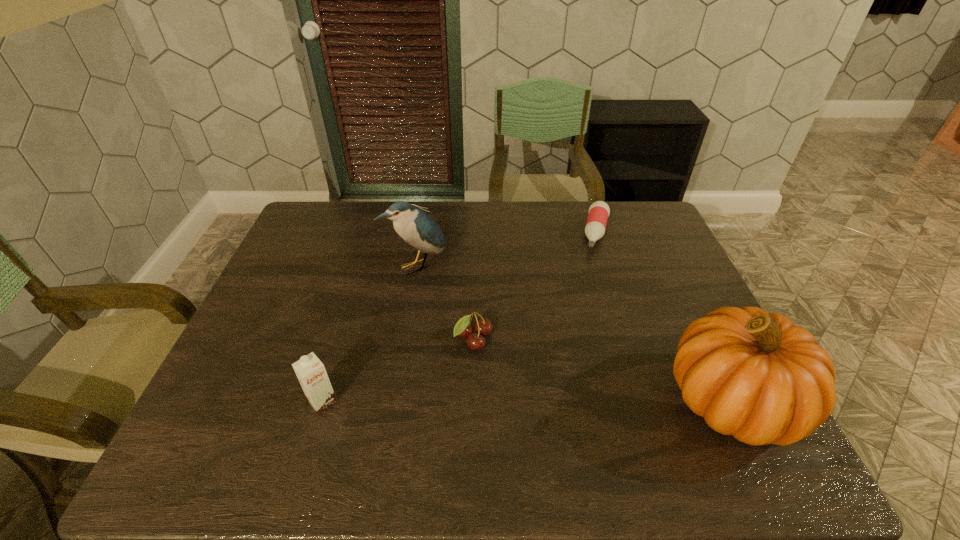
Find the location of a particular element. pumpkin positioned at the near edge is located at coordinates coord(755,375).

Locate an element on the screen. The image size is (960, 540). object positioned at the right edge is located at coordinates (755, 375).

Locate an element on the screen. object that is at the near right corner is located at coordinates (755, 375).

This screenshot has width=960, height=540. I want to click on vacant region at the far edge of the desktop, so [x=451, y=223].

Find the location of a particular element. The height and width of the screenshot is (540, 960). vacant space at the near edge of the desktop is located at coordinates (635, 392).

This screenshot has height=540, width=960. Find the location of `vacant space at the left edge of the desktop`. vacant space at the left edge of the desktop is located at coordinates point(252,386).

This screenshot has height=540, width=960. Find the location of `free location at the right edge`. free location at the right edge is located at coordinates (685, 300).

This screenshot has width=960, height=540. I want to click on vacant space at the far left corner of the desktop, so click(x=325, y=235).

Image resolution: width=960 pixels, height=540 pixels. Identify the location of vacant space at the far right corner of the desktop. (605, 201).

Where is `free spot between the fourth object from right to left and the fourth tallest object`? The height and width of the screenshot is (540, 960). free spot between the fourth object from right to left and the fourth tallest object is located at coordinates (445, 302).